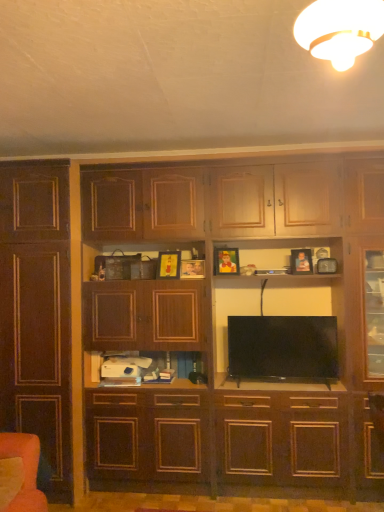
Question: From the image's perspective, does dark wood cupboard at center appear higher than orange fabric armchair at lower left?

Choices:
 (A) no
 (B) yes

Answer: (B)

Question: Is dark wood cupboard at center next to orange fabric armchair at lower left and touching it?

Choices:
 (A) yes
 (B) no

Answer: (B)

Question: Are dark wood cupboard at center and orange fabric armchair at lower left far apart?

Choices:
 (A) yes
 (B) no

Answer: (A)

Question: Is dark wood cupboard at center positioned behind orange fabric armchair at lower left?

Choices:
 (A) yes
 (B) no

Answer: (A)

Question: Is dark wood cupboard at center facing away from orange fabric armchair at lower left?

Choices:
 (A) no
 (B) yes

Answer: (A)

Question: Can you confirm if dark wood cupboard at center is taller than orange fabric armchair at lower left?

Choices:
 (A) no
 (B) yes

Answer: (B)

Question: From a real-world perspective, is dark wood cabinet at left located higher than black glossy tv at center?

Choices:
 (A) no
 (B) yes

Answer: (B)

Question: From a real-world perspective, does dark wood cabinet at left sit lower than black glossy tv at center?

Choices:
 (A) yes
 (B) no

Answer: (B)

Question: Does dark wood cabinet at left have a lesser width compared to black glossy tv at center?

Choices:
 (A) no
 (B) yes

Answer: (A)

Question: Considering the relative sizes of dark wood cabinet at left and black glossy tv at center in the image provided, is dark wood cabinet at left taller than black glossy tv at center?

Choices:
 (A) no
 (B) yes

Answer: (B)

Question: From the image's perspective, is dark wood cabinet at left over black glossy tv at center?

Choices:
 (A) yes
 (B) no

Answer: (A)

Question: Is dark wood cabinet at left not near black glossy tv at center?

Choices:
 (A) no
 (B) yes

Answer: (B)

Question: Are dark wood cabinet at left and matte brown cabinet at center beside each other?

Choices:
 (A) yes
 (B) no

Answer: (B)